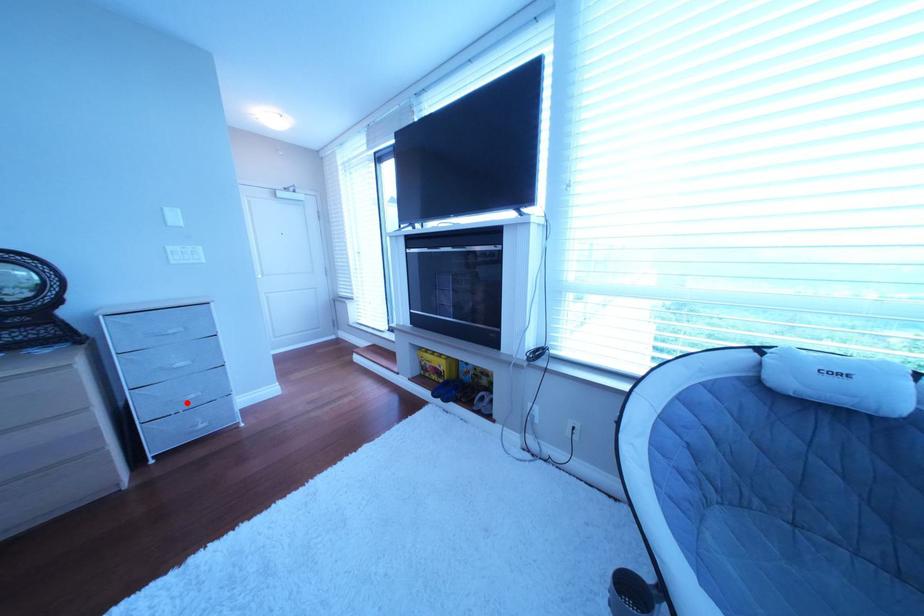
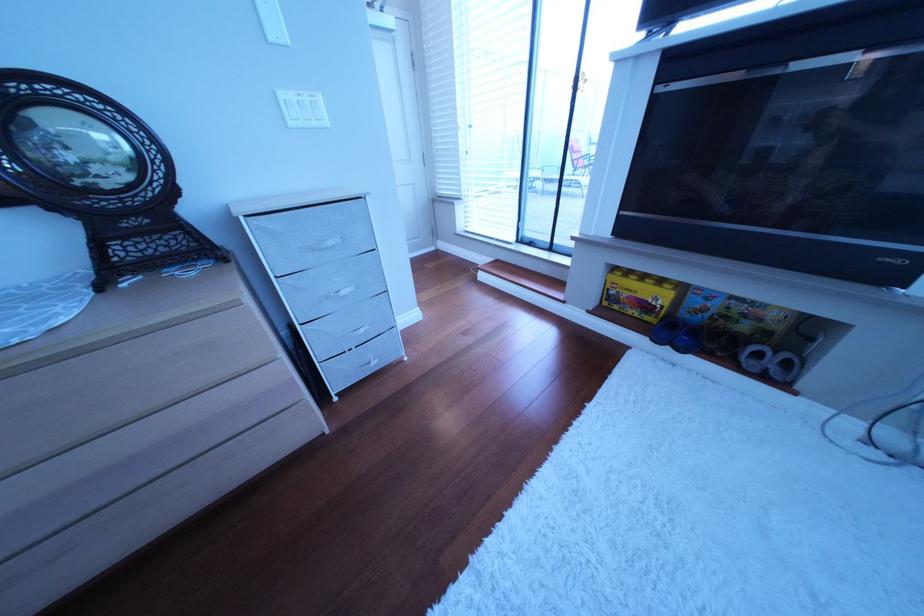
The point at the highlighted location is marked in the first image. Where is the corresponding point in the second image?

(358, 339)